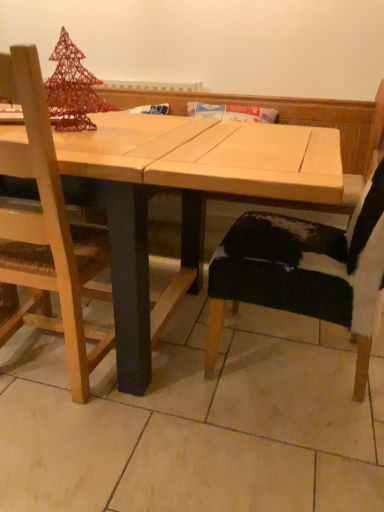
Question: Do you think wooden chair at left, positioned as the 2th chair in right-to-left order, is within natural wood table at center, or outside of it?

Choices:
 (A) outside
 (B) inside

Answer: (B)

Question: Is wooden chair at left, positioned as the 2th chair in right-to-left order, bigger or smaller than natural wood table at center?

Choices:
 (A) big
 (B) small

Answer: (B)

Question: Estimate the real-world distances between objects in this image. Which object is farther from the wooden chair at left, positioned as the 2th chair in right-to-left order?

Choices:
 (A) cowhide black chair at lower right, acting as the first chair starting from the right
 (B) natural wood table at center

Answer: (A)

Question: Based on their relative distances, which object is farther from the wooden chair at left, marked as the 1th chair in a left-to-right arrangement?

Choices:
 (A) cowhide black chair at lower right, arranged as the 2th chair when viewed from the left
 (B) natural wood table at center

Answer: (A)